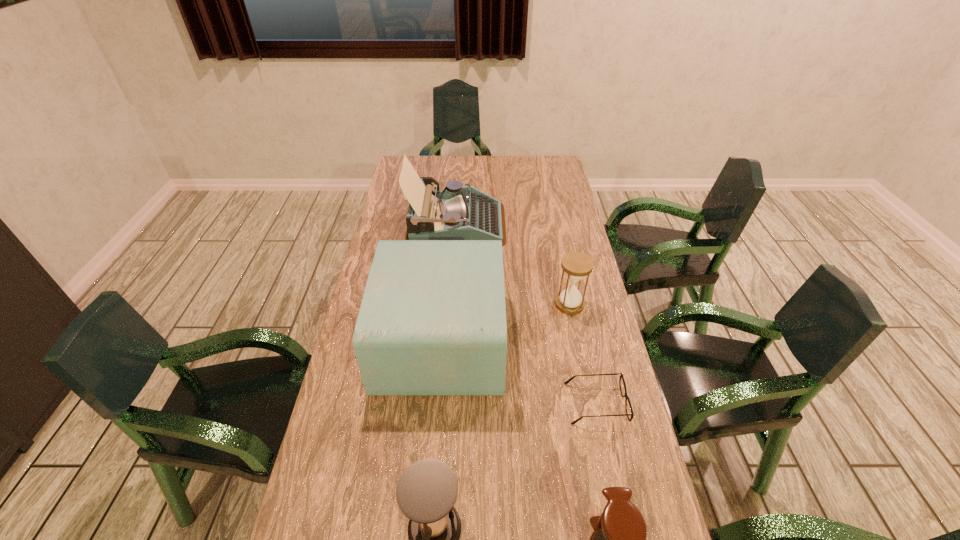
Locate an element on the screen. The width and height of the screenshot is (960, 540). free space between the radio receiver and the shortest object is located at coordinates (518, 372).

What are the coordinates of `free space between the spectacles and the radio receiver` in the screenshot? It's located at (518, 372).

You are a GUI agent. You are given a task and a screenshot of the screen. Output one action in this format:
    pyautogui.click(x=<x>, y=<y>)
    Task: Click on the fifth closest object to the shortest object
    The height and width of the screenshot is (540, 960).
    Given the screenshot: What is the action you would take?
    pyautogui.click(x=456, y=213)

I want to click on object that is the fourth closest to the radio receiver, so click(427, 490).

Locate an element on the screen. hourglass that is the second closest to the leftmost hourglass is located at coordinates (576, 265).

Point out which hourglass is positioned as the nearest to the spectacles. Please provide its 2D coordinates. Your answer should be formatted as a tuple, i.e. [(x, y)], where the tuple contains the x and y coordinates of a point satisfying the conditions above.

[(619, 539)]

Locate an element on the screen. The width and height of the screenshot is (960, 540). free location that satisfies the following two spatial constraints: 1. on the typing side of the farthest hourglass; 2. on the right side of the typewriter is located at coordinates (451, 304).

You are a GUI agent. You are given a task and a screenshot of the screen. Output one action in this format:
    pyautogui.click(x=<x>, y=<y>)
    Task: Click on the free space that satisfies the following two spatial constraints: 1. on the typing side of the farthest object; 2. on the back side of the farthest hourglass
    The width and height of the screenshot is (960, 540).
    Given the screenshot: What is the action you would take?
    pyautogui.click(x=451, y=304)

Identify the location of free location that satisfies the following two spatial constraints: 1. on the typing side of the farthest object; 2. on the left side of the farthest hourglass. This screenshot has height=540, width=960. (451, 304).